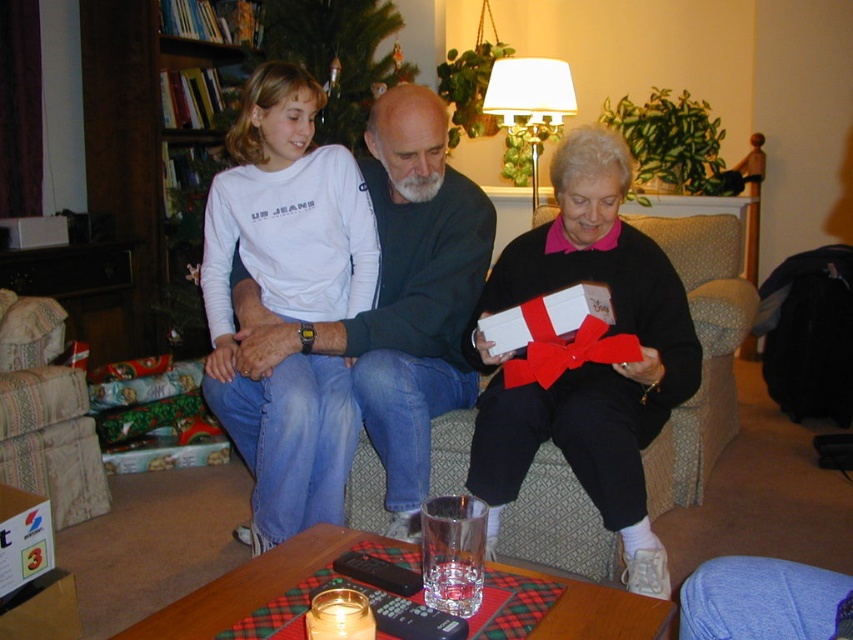
You are a photographer standing in front of the scene. You want to take a photo of the white cotton shirt at upper left and the patterned fabric armchair at lower left. Which object will appear larger in your photo?

The white cotton shirt at upper left will appear larger in the photo because it is closer to the viewer than the patterned fabric armchair at lower left.

You are a guest at a holiday gathering and see the matte white gift box at center and the white cotton shirt at upper left. Which object is closer to you?

The matte white gift box at center is closer to you because it is in front of the white cotton shirt at upper left.

You are a delivery person who needs to place a matte white gift box at center on the coffee table. The camera is mounted on the ceiling 1.90 meters away. If you place the gift box exactly where it is shown, will it be visible in the camera feed?

The matte white gift box at center and camera are 1.90 meters apart, so yes, the gift box will be visible in the camera feed since it is within the camera range.